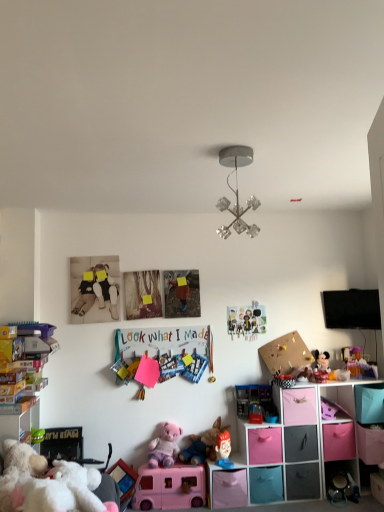
Question: Does pink fabric drawer at lower right, the 5th drawer positioned from the right, come in front of matte plastic drawer at lower right, placed as the 5th drawer when sorted from left to right?

Choices:
 (A) yes
 (B) no

Answer: (A)

Question: Considering the relative sizes of pink fabric drawer at lower right, the 5th drawer positioned from the right, and matte plastic drawer at lower right, marked as the second drawer in a right-to-left arrangement, in the image provided, is pink fabric drawer at lower right, the 5th drawer positioned from the right, smaller than matte plastic drawer at lower right, marked as the second drawer in a right-to-left arrangement,?

Choices:
 (A) no
 (B) yes

Answer: (A)

Question: Is pink fabric drawer at lower right, which ranks as the 2th drawer in left-to-right order, not near matte plastic drawer at lower right, placed as the 5th drawer when sorted from left to right?

Choices:
 (A) no
 (B) yes

Answer: (A)

Question: Is pink fabric drawer at lower right, which ranks as the 2th drawer in left-to-right order, positioned with its back to matte plastic drawer at lower right, marked as the second drawer in a right-to-left arrangement?

Choices:
 (A) yes
 (B) no

Answer: (B)

Question: Considering the relative positions of pink fabric drawer at lower right, which ranks as the 2th drawer in left-to-right order, and matte plastic drawer at lower right, placed as the 5th drawer when sorted from left to right, in the image provided, is pink fabric drawer at lower right, which ranks as the 2th drawer in left-to-right order, to the left of matte plastic drawer at lower right, placed as the 5th drawer when sorted from left to right, from the viewer's perspective?

Choices:
 (A) yes
 (B) no

Answer: (A)

Question: Is pink fabric drawer at lower right, which ranks as the 2th drawer in left-to-right order, shorter than matte plastic drawer at lower right, marked as the second drawer in a right-to-left arrangement?

Choices:
 (A) no
 (B) yes

Answer: (A)

Question: From a real-world perspective, does matte plastic toy at lower center, positioned as the fifth toy in right-to-left order, stand above pink fabric drawer at lower right, which ranks as the 2th drawer in left-to-right order?

Choices:
 (A) yes
 (B) no

Answer: (B)

Question: Is matte plastic toy at lower center, positioned as the fifth toy in right-to-left order, wider than pink fabric drawer at lower right, which ranks as the 2th drawer in left-to-right order?

Choices:
 (A) no
 (B) yes

Answer: (A)

Question: Is there a large distance between matte plastic toy at lower center, which appears as the 6th toy when viewed from the left, and pink fabric drawer at lower right, the 5th drawer positioned from the right?

Choices:
 (A) no
 (B) yes

Answer: (A)

Question: Is matte plastic toy at lower center, which appears as the 6th toy when viewed from the left, to the left of pink fabric drawer at lower right, which ranks as the 2th drawer in left-to-right order, from the viewer's perspective?

Choices:
 (A) yes
 (B) no

Answer: (A)

Question: From the image's perspective, does matte plastic toy at lower center, positioned as the fifth toy in right-to-left order, appear lower than pink fabric drawer at lower right, which ranks as the 2th drawer in left-to-right order?

Choices:
 (A) no
 (B) yes

Answer: (B)

Question: Is matte plastic toy at lower center, positioned as the fifth toy in right-to-left order, bigger than pink fabric drawer at lower right, the 5th drawer positioned from the right?

Choices:
 (A) yes
 (B) no

Answer: (B)

Question: Can you confirm if matte paper collage at center, placed as the seventh toy when sorted from left to right, is positioned to the right of gray matte drawer at lower right, the 3th drawer positioned from the right?

Choices:
 (A) no
 (B) yes

Answer: (A)